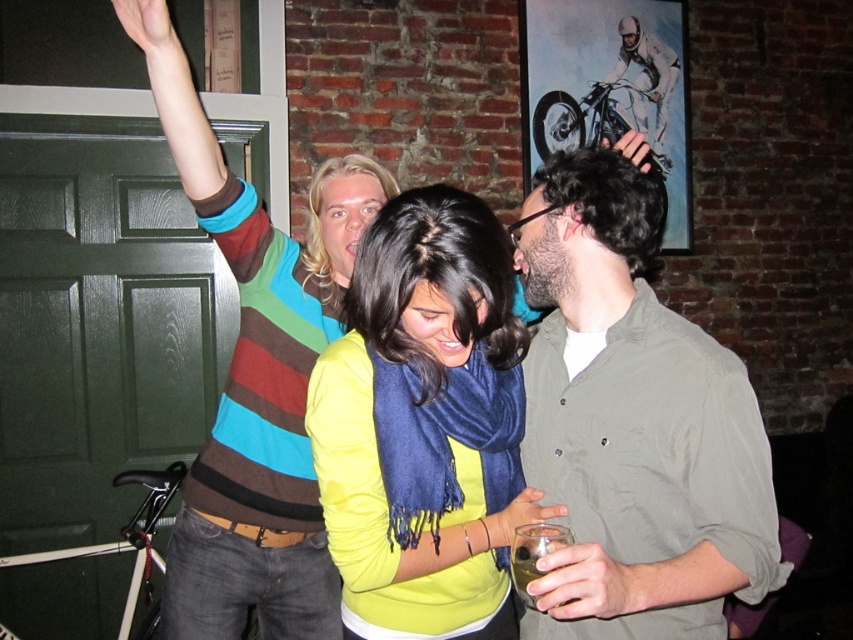
Based on the photo, you are standing in the room and want to reach both points. Which point should you reach first, point [426,321] or point [567,529]?

You should reach point [426,321] first because it is closer to you than point [567,529].

You are organizing a small party and need to arrange seating. There is a chair with a seat width of 40 cm. Can the person wearing the matte green shirt at center sit comfortably on it given their shirt width compared to the translucent glass at lower center?

The matte green shirt at center has a larger width than the translucent glass at lower center. Since the shirt is wider, the person might find the 40 cm seat width restrictive. It is advisable to choose a wider seat to accommodate their clothing comfortably.

You are trying to determine which clothing item is taller between the matte green shirt at center and the yellow matte sweater at center. Based on the scene description, which one is taller?

The matte green shirt at center is taller than the yellow matte sweater at center according to the description.